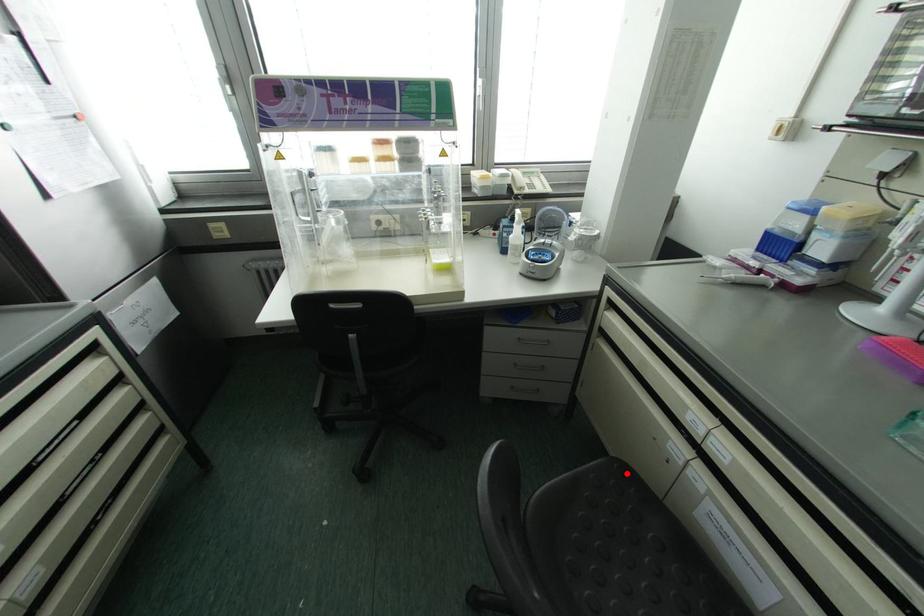
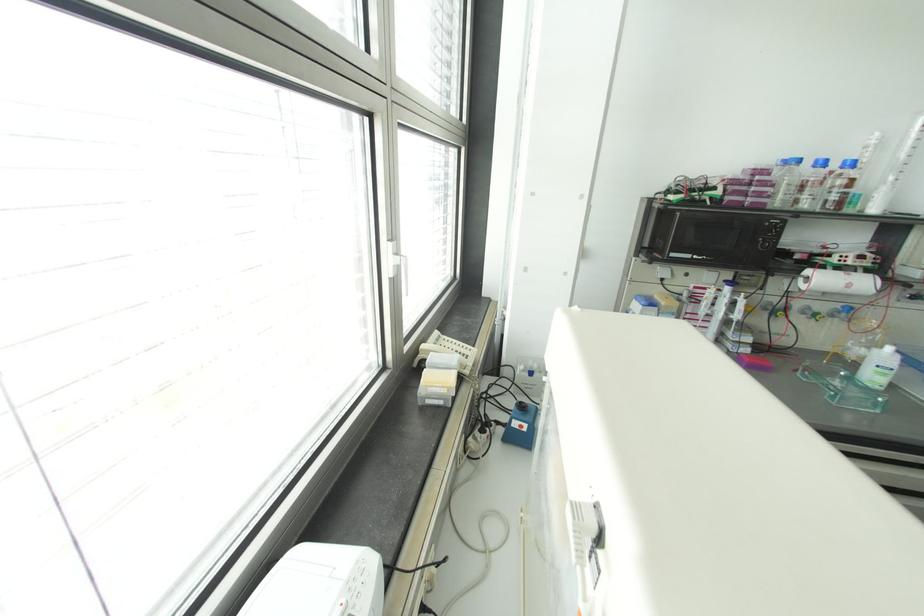
Question: I am providing you with two images of the same scene from different viewpoints. A red point is marked on the first image. Can you still see the location of the red point in image 2?

Choices:
 (A) Yes
 (B) No

Answer: (B)